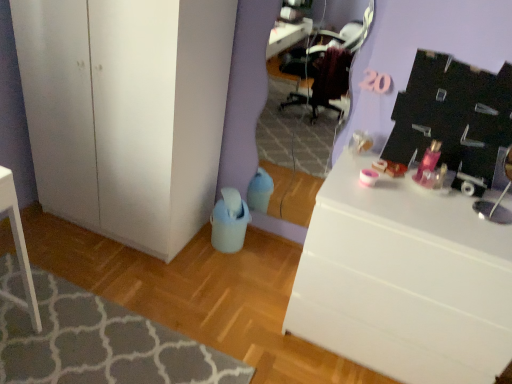
Image resolution: width=512 pixels, height=384 pixels. I want to click on vacant area on top of textured gray rug at lower left (from a real-world perspective), so click(x=84, y=333).